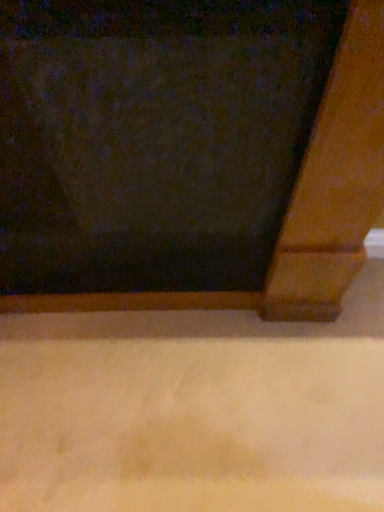
This screenshot has width=384, height=512. What are the coordinates of `matte wood frame at lower right` in the screenshot? It's located at (188, 153).

The height and width of the screenshot is (512, 384). Describe the element at coordinates (188, 153) in the screenshot. I see `matte wood frame at lower right` at that location.

The width and height of the screenshot is (384, 512). In order to click on matte wood frame at lower right in this screenshot , I will do `click(188, 153)`.